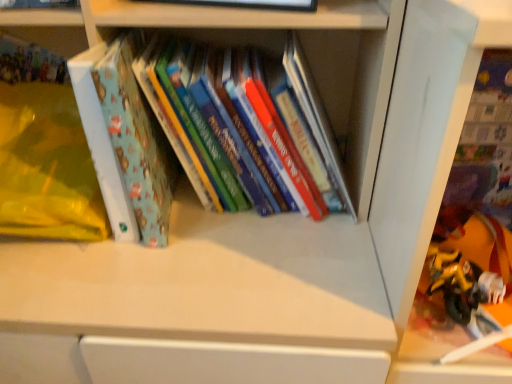
Describe the element at coordinates (136, 140) in the screenshot. The width and height of the screenshot is (512, 384). I see `matte blue book at left` at that location.

From the picture: Measure the distance between matte blue book at left and camera.

matte blue book at left is 22.27 inches from camera.

Describe the element at coordinates (108, 133) in the screenshot. I see `hardcover books at center, the 1th book in the right-to-left sequence` at that location.

Identify the location of matte blue book at left. This screenshot has height=384, width=512. (136, 140).

Considering the relative positions of yellow matte toy at lower right and matte blue book at left in the image provided, is yellow matte toy at lower right to the left of matte blue book at left from the viewer's perspective?

No.

How distant is yellow matte toy at lower right from matte blue book at left?

The distance of yellow matte toy at lower right from matte blue book at left is 51.92 centimeters.

Is yellow matte toy at lower right spatially inside matte blue book at left, or outside of it?

yellow matte toy at lower right is not enclosed by matte blue book at left.

Considering the relative sizes of yellow matte toy at lower right and matte blue book at left in the image provided, is yellow matte toy at lower right smaller than matte blue book at left?

Correct, yellow matte toy at lower right occupies less space than matte blue book at left.

Is hardcover books at center, the 2th book when ordered from left to right, not within matte blue book at upper left, placed as the second book when sorted from bottom to top?

Absolutely, hardcover books at center, the 2th book when ordered from left to right, is external to matte blue book at upper left, placed as the second book when sorted from bottom to top.

Locate an element on the screen. The image size is (512, 384). book that appears in front of the hardcover books at center, the 1th book in the right-to-left sequence is located at coordinates (38, 4).

Is hardcover books at center, the second book in the top-to-bottom sequence, facing towards matte blue book at upper left, placed as the 1th book when sorted from left to right?

No, hardcover books at center, the second book in the top-to-bottom sequence, is not turned towards matte blue book at upper left, placed as the 1th book when sorted from left to right.

From the picture: From the image's perspective, is matte blue book at left located above or below hardcover books at center, the 1th book in the right-to-left sequence?

Based on their image positions, matte blue book at left is located beneath hardcover books at center, the 1th book in the right-to-left sequence.

Does matte blue book at left contain hardcover books at center, the 2th book when ordered from left to right?

No, hardcover books at center, the 2th book when ordered from left to right, is located outside of matte blue book at left.

Which of these two, matte blue book at left or hardcover books at center, the second book in the top-to-bottom sequence, stands shorter?

hardcover books at center, the second book in the top-to-bottom sequence, is shorter.

Who is smaller, matte blue book at left or hardcover books at center, which is the first book in bottom-to-top order?

Smaller between the two is matte blue book at left.

From a real-world perspective, which object stands above the other?

matte blue book at left, from a real-world perspective.

Is point (119, 143) behind point (475, 267)?

No, it is not.

Between matte blue book at left and yellow matte toy at lower right, which one is positioned in front?

matte blue book at left is more forward.

From the image's perspective, which one is positioned higher, matte blue book at left or yellow matte toy at lower right?

matte blue book at left appears higher in the image.

Which is in front, point (477, 166) or point (177, 166)?

The point (477, 166) is closer.

Who is smaller, transparent plastic toys at lower right or matte blue book at left?

With smaller size is matte blue book at left.

Which is behind, transparent plastic toys at lower right or matte blue book at left?

matte blue book at left is more distant.

Is transparent plastic toys at lower right taller or shorter than matte blue book at upper left, the first book from the top?

Clearly, transparent plastic toys at lower right is taller compared to matte blue book at upper left, the first book from the top.

Looking at this image, is transparent plastic toys at lower right positioned beyond the bounds of matte blue book at upper left, the first book from the top?

transparent plastic toys at lower right lies outside matte blue book at upper left, the first book from the top,'s area.

Which is more to the left, transparent plastic toys at lower right or matte blue book at upper left, the first book from the top?

Positioned to the left is matte blue book at upper left, the first book from the top.

Which of these two, transparent plastic toys at lower right or matte blue book at upper left, the first book from the top, is thinner?

matte blue book at upper left, the first book from the top, is thinner.

Considering the relative sizes of transparent plastic toys at lower right and yellow matte toy at lower right in the image provided, is transparent plastic toys at lower right taller than yellow matte toy at lower right?

Correct, transparent plastic toys at lower right is much taller as yellow matte toy at lower right.

Which is behind, point (420, 372) or point (483, 290)?

The point (483, 290) is more distant.

Between transparent plastic toys at lower right and yellow matte toy at lower right, which one has smaller size?

With smaller size is yellow matte toy at lower right.

Identify the location of toy behind the matte blue book at left. The height and width of the screenshot is (384, 512). (461, 283).

Find the location of a particular element. This screenshot has width=512, height=384. book beneath the matte blue book at upper left, which is the 2th book from right to left (from a real-world perspective) is located at coordinates (108, 133).

From the image, which object appears to be nearer to matte blue book at upper left, which is the 2th book from right to left, matte blue book at left or hardcover books at center, the second book in the top-to-bottom sequence?

hardcover books at center, the second book in the top-to-bottom sequence, is positioned closer to the anchor matte blue book at upper left, which is the 2th book from right to left.

Looking at the image, which one is located closer to matte blue book at left, hardcover books at center, the 2th book when ordered from left to right, or transparent plastic toys at lower right?

Based on the image, hardcover books at center, the 2th book when ordered from left to right, appears to be nearer to matte blue book at left.

Estimate the real-world distances between objects in this image. Which object is closer to matte blue book at left, matte blue book at upper left, which is the 2th book from right to left, or yellow matte toy at lower right?

The object closer to matte blue book at left is matte blue book at upper left, which is the 2th book from right to left.

Estimate the real-world distances between objects in this image. Which object is closer to yellow matte toy at lower right, matte blue book at upper left, placed as the 1th book when sorted from left to right, or transparent plastic toys at lower right?

transparent plastic toys at lower right.

Estimate the real-world distances between objects in this image. Which object is closer to matte blue book at left, hardcover books at center, which is the first book in bottom-to-top order, or yellow matte toy at lower right?

hardcover books at center, which is the first book in bottom-to-top order, is closer to matte blue book at left.

Considering their positions, is transparent plastic toys at lower right positioned closer to matte blue book at left than yellow matte toy at lower right?

transparent plastic toys at lower right lies closer to matte blue book at left than the other object.

Considering their positions, is yellow matte toy at lower right positioned further to matte blue book at left than matte blue book at upper left, placed as the second book when sorted from bottom to top?

yellow matte toy at lower right lies further to matte blue book at left than the other object.

Estimate the real-world distances between objects in this image. Which object is closer to transparent plastic toys at lower right, matte blue book at left or yellow matte toy at lower right?

The object closer to transparent plastic toys at lower right is yellow matte toy at lower right.

In order to click on paperback book between matte blue book at upper left, the first book from the top, and hardcover books at center, the 2th book when ordered from left to right, from left to right in this screenshot , I will do `click(136, 140)`.

Locate an element on the screen. The image size is (512, 384). toy located between matte blue book at upper left, placed as the second book when sorted from bottom to top, and transparent plastic toys at lower right in the left-right direction is located at coordinates (461, 283).

Where is `book located between matte blue book at left and transparent plastic toys at lower right in the left-right direction`? The image size is (512, 384). book located between matte blue book at left and transparent plastic toys at lower right in the left-right direction is located at coordinates (108, 133).

Locate an element on the screen. The height and width of the screenshot is (384, 512). toy situated between matte blue book at left and transparent plastic toys at lower right from left to right is located at coordinates (461, 283).